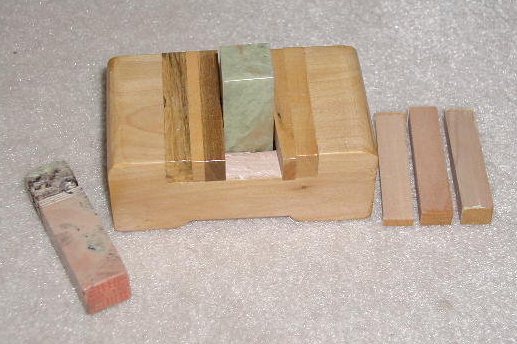
This screenshot has width=517, height=344. In order to click on carpet left of object in this screenshot , I will do `click(45, 127)`.